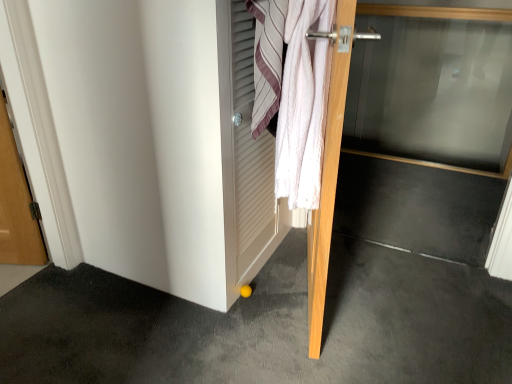
Image resolution: width=512 pixels, height=384 pixels. What do you see at coordinates (266, 325) in the screenshot?
I see `yellow rubber ball at lower center` at bounding box center [266, 325].

What is the approximate height of transparent glass door at center, placed as the first door when sorted from right to left?

It is 1.09 meters.

What do you see at coordinates (326, 202) in the screenshot?
I see `transparent glass door at center, marked as the 2th door in a left-to-right arrangement` at bounding box center [326, 202].

Describe the element at coordinates (303, 104) in the screenshot. Image resolution: width=512 pixels, height=384 pixels. I see `white cotton towel at upper right` at that location.

The height and width of the screenshot is (384, 512). In order to click on yellow rubber ball at lower center in this screenshot , I will do `click(266, 325)`.

Visually, is white cotton towel at upper right positioned to the left or to the right of wooden door at center, placed as the first door when sorted from left to right?

In the image, white cotton towel at upper right appears on the left side of wooden door at center, placed as the first door when sorted from left to right.

From the image's perspective, is white cotton towel at upper right on wooden door at center, acting as the second door starting from the right?

Indeed, from the image's perspective, white cotton towel at upper right is shown above wooden door at center, acting as the second door starting from the right.

Is white cotton towel at upper right completely or partially outside of wooden door at center, acting as the second door starting from the right?

Actually, white cotton towel at upper right is within wooden door at center, acting as the second door starting from the right.

From a real-world perspective, is white cotton towel at upper right physically located above or below wooden door at center, acting as the second door starting from the right?

From a real-world perspective, white cotton towel at upper right is physically above wooden door at center, acting as the second door starting from the right.

Can you confirm if white textured towel at center is bigger than yellow rubber ball at lower center?

Actually, white textured towel at center might be smaller than yellow rubber ball at lower center.

From the image's perspective, is white textured towel at center over yellow rubber ball at lower center?

Yes, from the image's perspective, white textured towel at center is on top of yellow rubber ball at lower center.

Is white textured towel at center turned away from yellow rubber ball at lower center?

That's not correct — white textured towel at center is not looking away from yellow rubber ball at lower center.

The height and width of the screenshot is (384, 512). I want to click on screen door above the wooden door at center, placed as the first door when sorted from left to right (from the image's perspective), so click(250, 163).

Does point (251, 21) appear closer or farther from the camera than point (325, 187)?

Point (251, 21).

Considering the relative sizes of white textured towel at center and wooden door at center, acting as the second door starting from the right, in the image provided, is white textured towel at center smaller than wooden door at center, acting as the second door starting from the right,?

Yes.

Are white textured towel at center and wooden door at center, placed as the first door when sorted from left to right, far apart?

No, white textured towel at center is in close proximity to wooden door at center, placed as the first door when sorted from left to right.

Does yellow rubber ball at lower center come in front of wooden door at center, acting as the second door starting from the right?

Yes, yellow rubber ball at lower center is closer to the viewer.

From the image's perspective, would you say yellow rubber ball at lower center is shown under wooden door at center, acting as the second door starting from the right?

Yes, from the image's perspective, yellow rubber ball at lower center is beneath wooden door at center, acting as the second door starting from the right.

From a real-world perspective, between yellow rubber ball at lower center and wooden door at center, acting as the second door starting from the right, who is vertically higher?

wooden door at center, acting as the second door starting from the right, from a real-world perspective.

Where is `the 1st door behind the yellow rubber ball at lower center`? the 1st door behind the yellow rubber ball at lower center is located at coordinates (326, 196).

From a real-world perspective, is white textured towel at center positioned above or below white cotton towel at upper right?

In terms of real-world spatial position, white textured towel at center is below white cotton towel at upper right.

Considering the positions of objects white textured towel at center and white cotton towel at upper right in the image provided, who is behind, white textured towel at center or white cotton towel at upper right?

white cotton towel at upper right is further away from the camera.

Considering the points (264, 253) and (297, 111), which point is behind, point (264, 253) or point (297, 111)?

The point (264, 253) is behind.

From the image's perspective, is white textured towel at center beneath white cotton towel at upper right?

Yes, from the image's perspective, white textured towel at center is below white cotton towel at upper right.

Is transparent glass door at center, marked as the 2th door in a left-to-right arrangement, next to wooden door at center, placed as the first door when sorted from left to right?

Yes, the surface of transparent glass door at center, marked as the 2th door in a left-to-right arrangement, is in contact with wooden door at center, placed as the first door when sorted from left to right.

Does transparent glass door at center, marked as the 2th door in a left-to-right arrangement, turn towards wooden door at center, placed as the first door when sorted from left to right?

Yes, transparent glass door at center, marked as the 2th door in a left-to-right arrangement, is turned towards wooden door at center, placed as the first door when sorted from left to right.

From a real-world perspective, does transparent glass door at center, placed as the first door when sorted from right to left, sit lower than wooden door at center, acting as the second door starting from the right?

Yes, from a real-world perspective, transparent glass door at center, placed as the first door when sorted from right to left, is beneath wooden door at center, acting as the second door starting from the right.

Choose the correct answer: Is transparent glass door at center, marked as the 2th door in a left-to-right arrangement, inside wooden door at center, acting as the second door starting from the right, or outside it?

transparent glass door at center, marked as the 2th door in a left-to-right arrangement, is not enclosed by wooden door at center, acting as the second door starting from the right.

Based on their positions, is white cotton towel at upper right located to the left or right of white textured towel at center?

Based on their positions, white cotton towel at upper right is located to the right of white textured towel at center.

Find the location of `screen door below the white cotton towel at upper right (from the image's perspective)`. screen door below the white cotton towel at upper right (from the image's perspective) is located at coordinates (250, 163).

Is white textured towel at center a part of white cotton towel at upper right?

No, white textured towel at center is not inside white cotton towel at upper right.

What's the angular difference between white cotton towel at upper right and white textured towel at center's facing directions?

A: 0.00117 degrees separate the facing orientations of white cotton towel at upper right and white textured towel at center.

The height and width of the screenshot is (384, 512). What are the coordinates of `bath towel located above the wooden door at center, acting as the second door starting from the right (from a real-world perspective)` in the screenshot? It's located at (303, 104).

The height and width of the screenshot is (384, 512). In order to click on concrete in front of the white textured towel at center in this screenshot , I will do `click(266, 325)`.

Which object lies nearer to the anchor point yellow rubber ball at lower center, transparent glass door at center, placed as the first door when sorted from right to left, or wooden door at center, placed as the first door when sorted from left to right?

The object closer to yellow rubber ball at lower center is wooden door at center, placed as the first door when sorted from left to right.

Based on their spatial positions, is yellow rubber ball at lower center or white textured towel at center closer to white cotton towel at upper right?

white textured towel at center lies closer to white cotton towel at upper right than the other object.

From the image, which object appears to be farther from transparent glass door at center, marked as the 2th door in a left-to-right arrangement, white textured towel at center or yellow rubber ball at lower center?

Among the two, yellow rubber ball at lower center is located further to transparent glass door at center, marked as the 2th door in a left-to-right arrangement.

From the image, which object appears to be farther from white cotton towel at upper right, transparent glass door at center, marked as the 2th door in a left-to-right arrangement, or white textured towel at center?

white textured towel at center lies further to white cotton towel at upper right than the other object.

When comparing their distances from yellow rubber ball at lower center, does white textured towel at center or white cotton towel at upper right seem closer?

white textured towel at center.

Estimate the real-world distances between objects in this image. Which object is closer to transparent glass door at center, marked as the 2th door in a left-to-right arrangement, yellow rubber ball at lower center or white textured towel at center?

white textured towel at center is closer to transparent glass door at center, marked as the 2th door in a left-to-right arrangement.

Based on their spatial positions, is white textured towel at center or yellow rubber ball at lower center further from white cotton towel at upper right?

Based on the image, yellow rubber ball at lower center appears to be further to white cotton towel at upper right.

Estimate the real-world distances between objects in this image. Which object is further from white textured towel at center, white cotton towel at upper right or transparent glass door at center, placed as the first door when sorted from right to left?

transparent glass door at center, placed as the first door when sorted from right to left, lies further to white textured towel at center than the other object.

Identify the location of door located between white cotton towel at upper right and transparent glass door at center, marked as the 2th door in a left-to-right arrangement, in the left-right direction. (326, 196).

You are a GUI agent. You are given a task and a screenshot of the screen. Output one action in this format:
    pyautogui.click(x=<x>, y=<y>)
    Task: Click on the door between white textured towel at center and yellow rubber ball at lower center in the up-down direction
    This screenshot has width=512, height=384.
    Given the screenshot: What is the action you would take?
    pyautogui.click(x=326, y=196)

The height and width of the screenshot is (384, 512). I want to click on screen door between transparent glass door at center, marked as the 2th door in a left-to-right arrangement, and yellow rubber ball at lower center from top to bottom, so click(x=250, y=163).

Where is `bath towel between white textured towel at center and transparent glass door at center, marked as the 2th door in a left-to-right arrangement`? Image resolution: width=512 pixels, height=384 pixels. bath towel between white textured towel at center and transparent glass door at center, marked as the 2th door in a left-to-right arrangement is located at coordinates (303, 104).